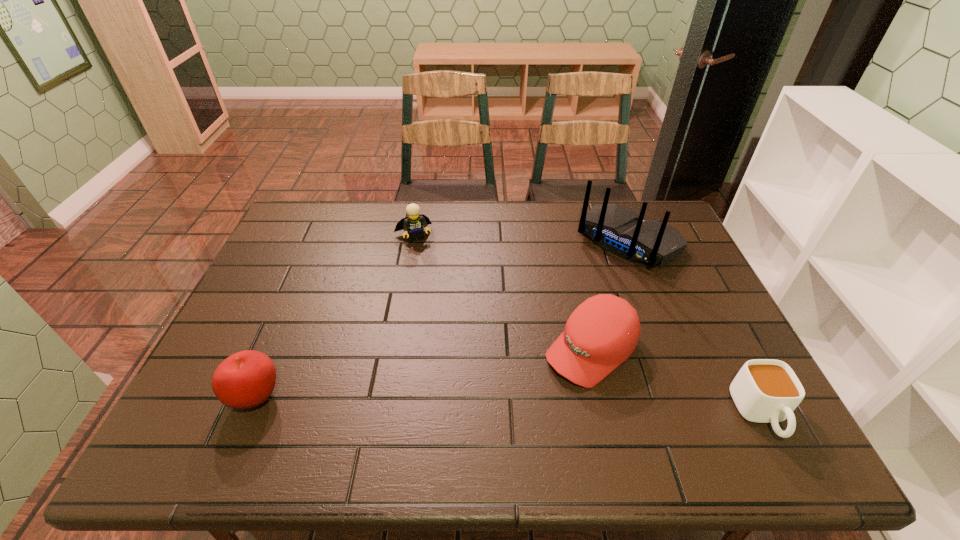
I want to click on the closest object to the shortest object, so click(602, 332).

Locate an element on the screen. object identified as the second closest to the cup is located at coordinates (x=616, y=229).